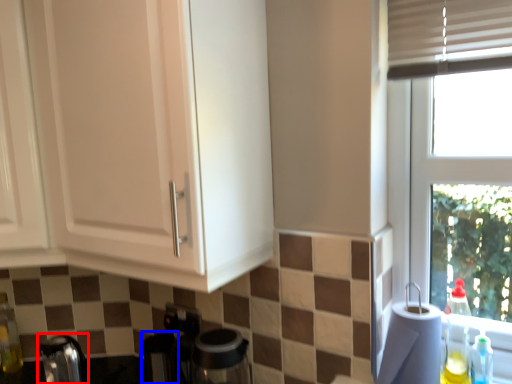
Question: Which point is closer to the camera, faucet (highlighted by a red box) or appliance (highlighted by a blue box)?

Choices:
 (A) faucet
 (B) appliance

Answer: (A)